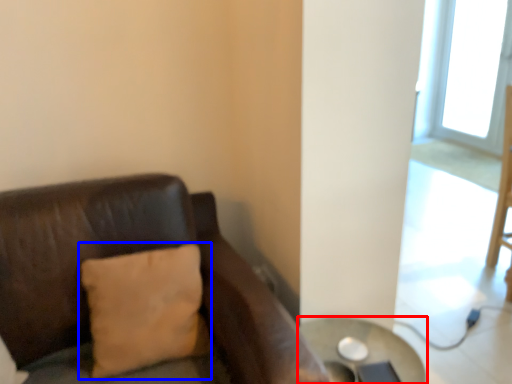
Question: Which point is closer to the camera, table (highlighted by a red box) or pillow (highlighted by a blue box)?

Choices:
 (A) table
 (B) pillow

Answer: (B)